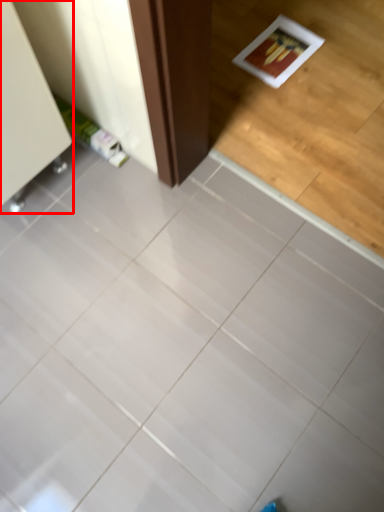
Question: From the image's perspective, what is the correct spatial relationship of furniture (annotated by the red box) in relation to ceramic tile?

Choices:
 (A) below
 (B) above

Answer: (B)